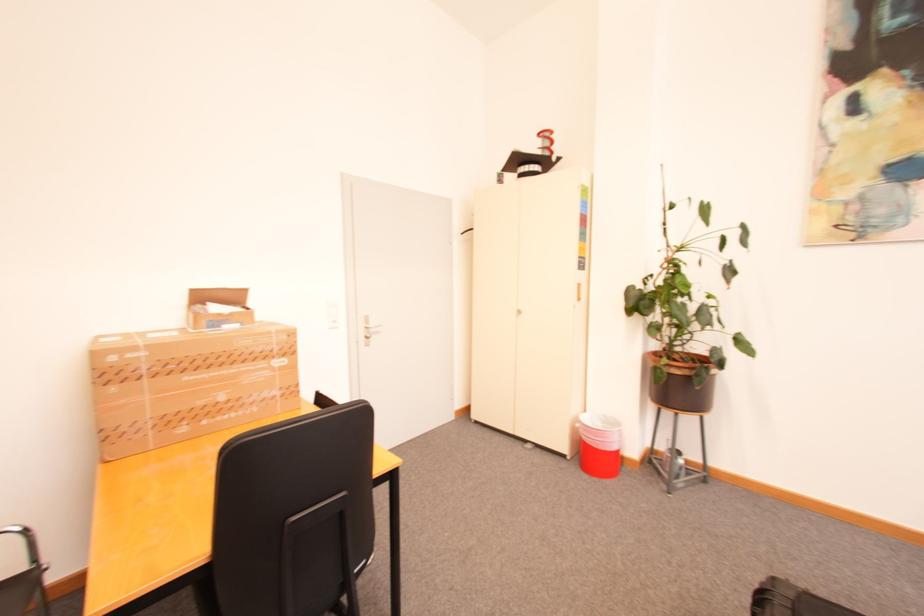
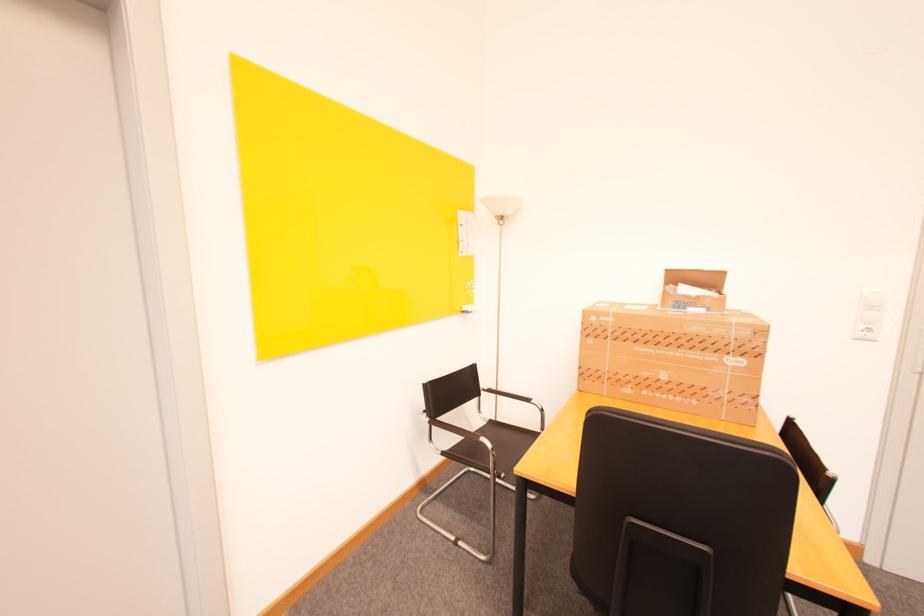
Question: The camera is either moving clockwise (left) or counter-clockwise (right) around the object. The first image is from the beginning of the video and the second image is from the end. Is the camera moving left or right when shooting the video?

Choices:
 (A) Left
 (B) Right

Answer: (B)